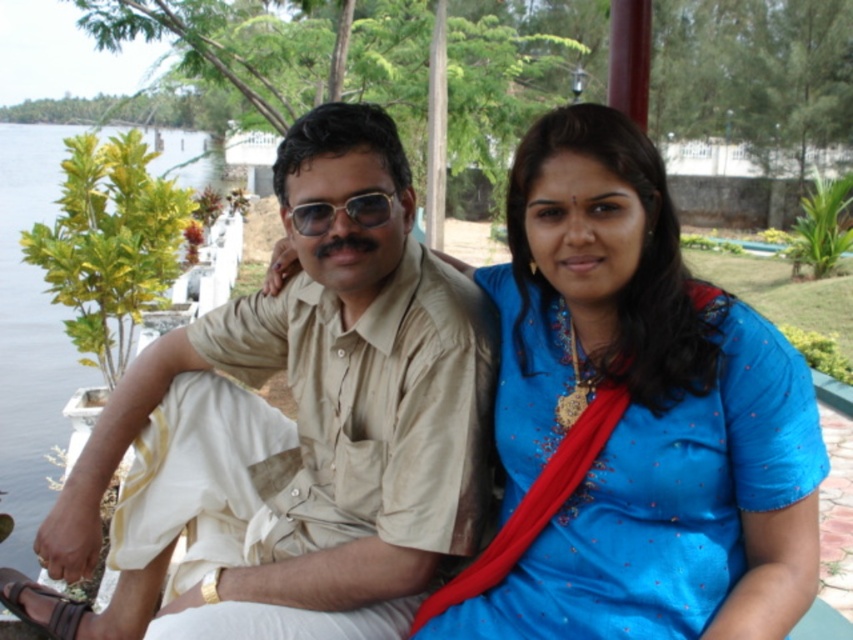
Is blue silk saree at center to the left of green leafy water at left from the viewer's perspective?

In fact, blue silk saree at center is to the right of green leafy water at left.

Who is more forward, (619, 371) or (161, 168)?

Positioned in front is point (619, 371).

Identify the location of blue silk saree at center. (625, 413).

The width and height of the screenshot is (853, 640). I want to click on blue silk saree at center, so click(x=625, y=413).

The image size is (853, 640). Describe the element at coordinates (292, 433) in the screenshot. I see `beige cotton shirt at center` at that location.

At what (x,y) coordinates should I click in order to perform the action: click on beige cotton shirt at center. Please return your answer as a coordinate pair (x, y). The width and height of the screenshot is (853, 640). Looking at the image, I should click on (292, 433).

Image resolution: width=853 pixels, height=640 pixels. What are the coordinates of `beige cotton shirt at center` in the screenshot? It's located at (292, 433).

Who is more distant from viewer, (300, 344) or (22, 284)?

The point (22, 284) is behind.

Who is taller, beige cotton shirt at center or green leafy water at left?

green leafy water at left

Between point (296, 310) and point (3, 476), which one is positioned in front?

Point (296, 310) is in front.

Find the location of `beige cotton shirt at center`. beige cotton shirt at center is located at coordinates (292, 433).